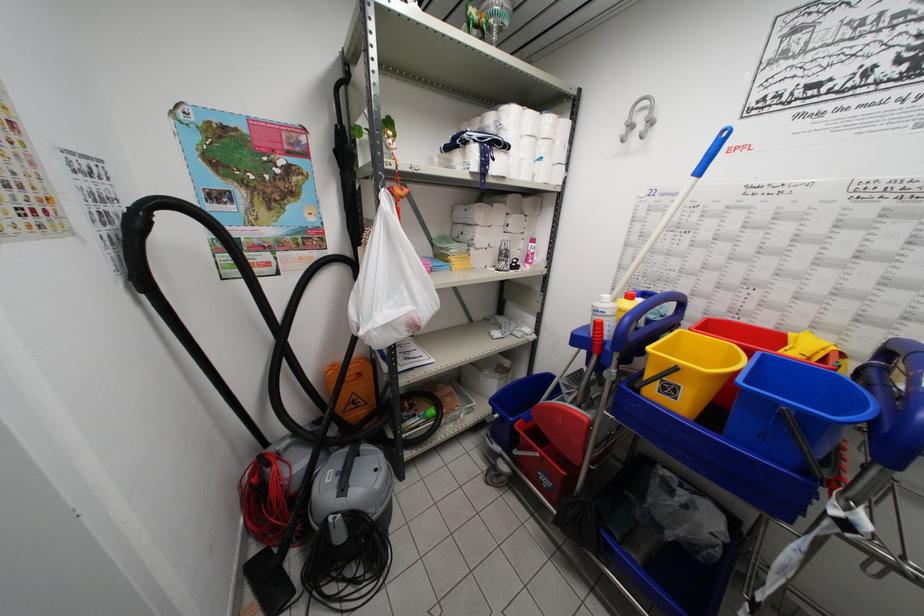
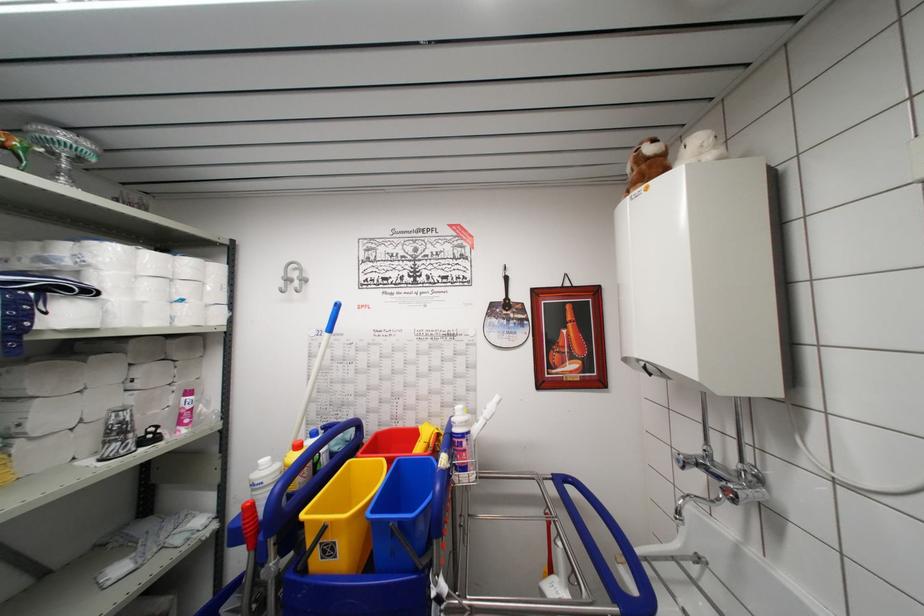
Locate, in the second image, the point that corresponds to [663,397] in the first image.

(325, 562)